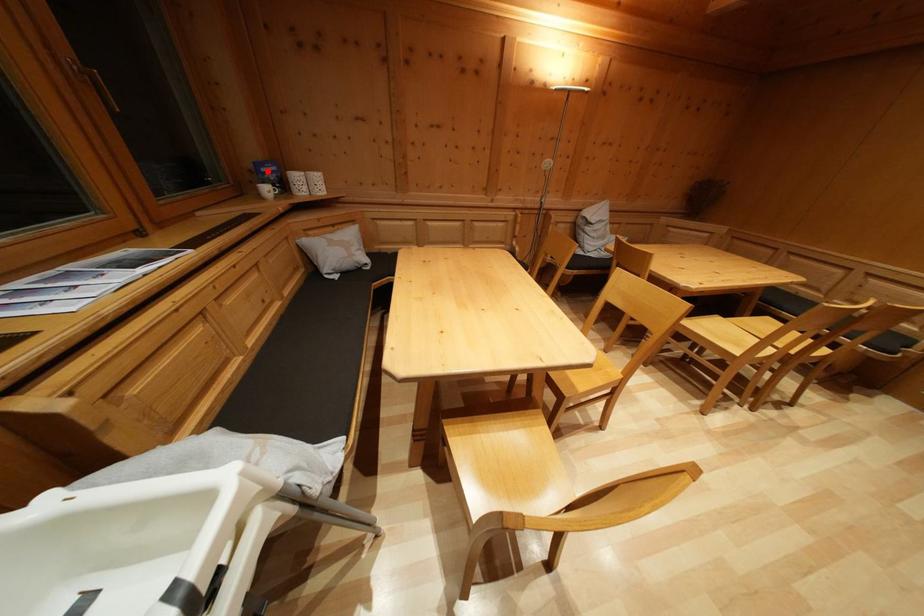
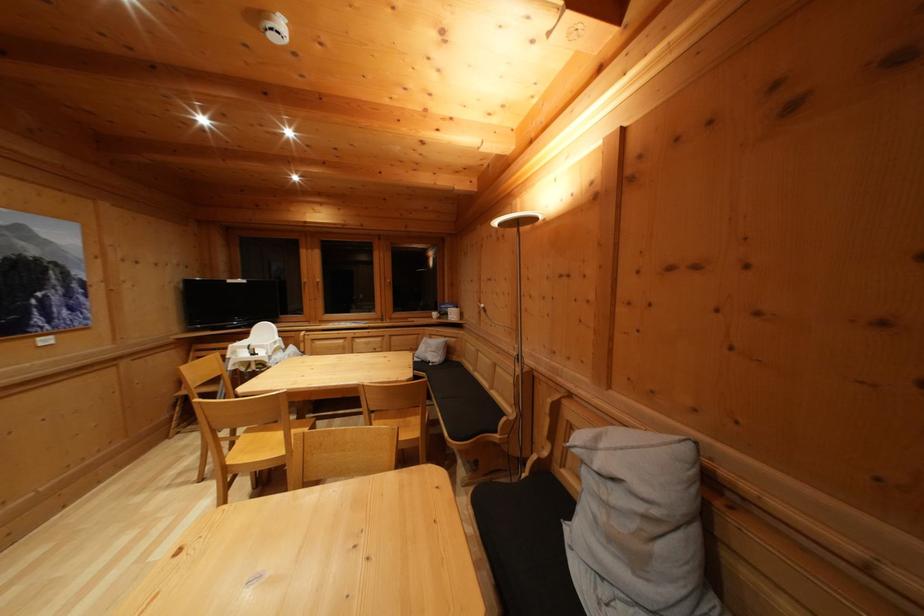
Where in the second image is the point corresponding to the highlighted location from the first image?

(450, 310)